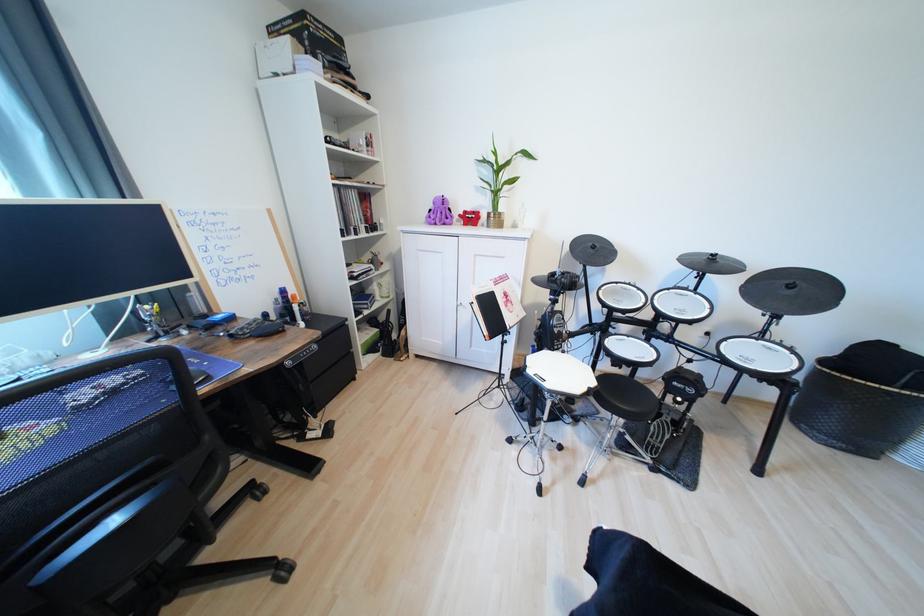
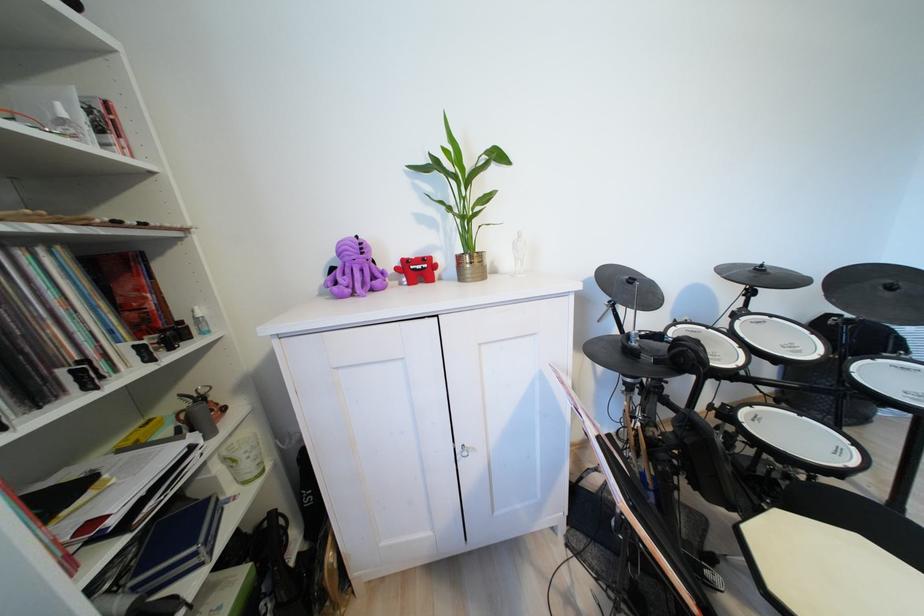
Find the pixel in the second image that matches (x=721, y=257) in the first image.

(769, 267)